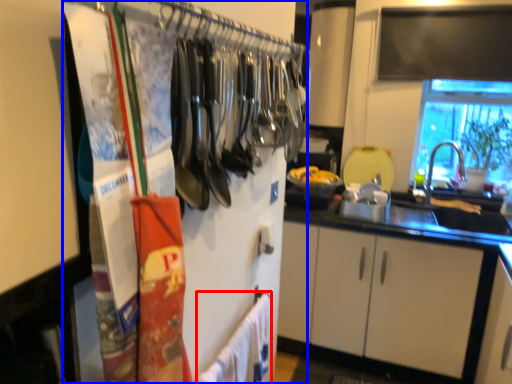
Question: Which point is closer to the camera, bath towel (highlighted by a red box) or closet (highlighted by a blue box)?

Choices:
 (A) bath towel
 (B) closet

Answer: (B)